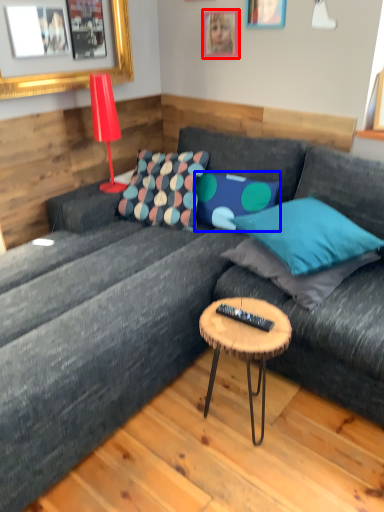
Question: Which object is closer to the camera taking this photo, picture frame (highlighted by a red box) or pillow (highlighted by a blue box)?

Choices:
 (A) picture frame
 (B) pillow

Answer: (B)